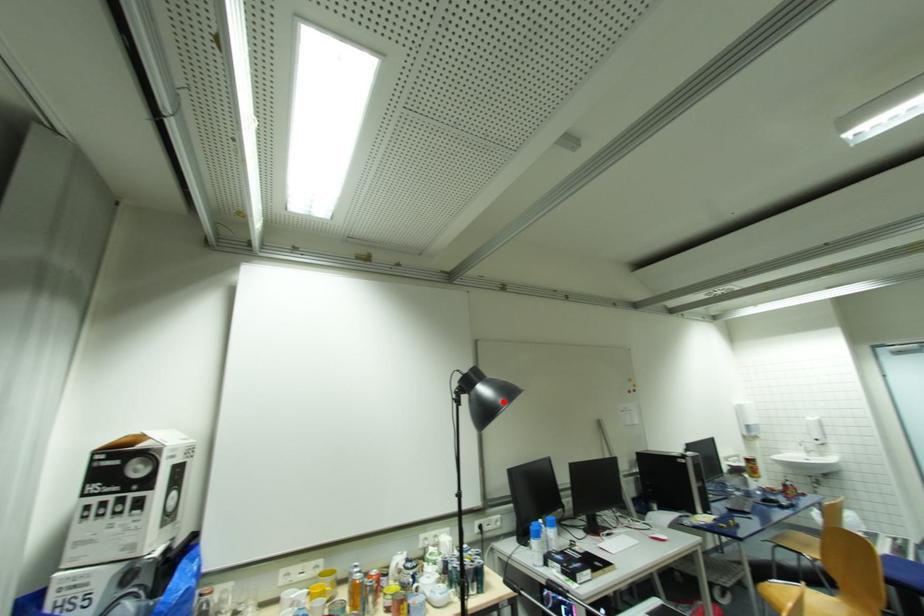
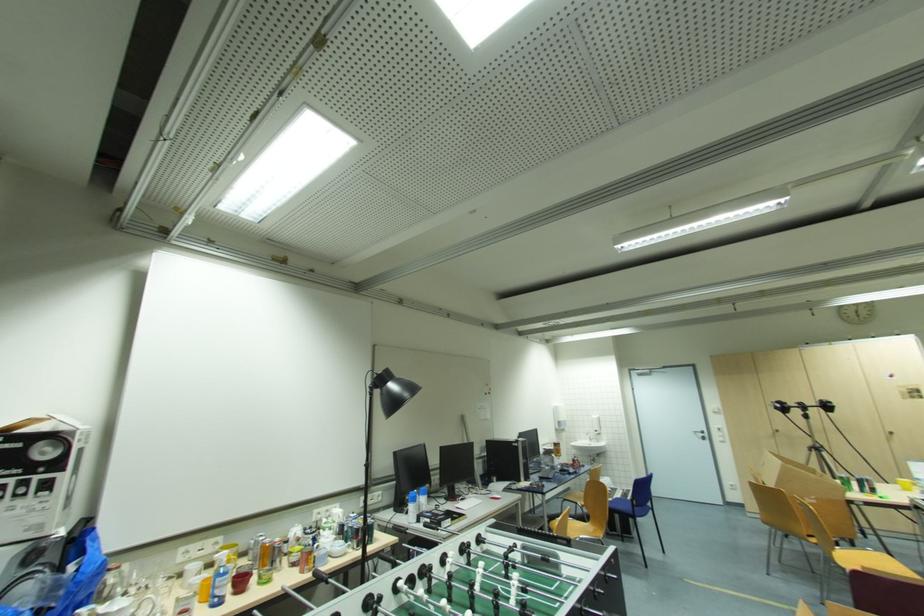
Locate, in the second image, the point that corresponds to the highlighted location in the first image.

(409, 395)